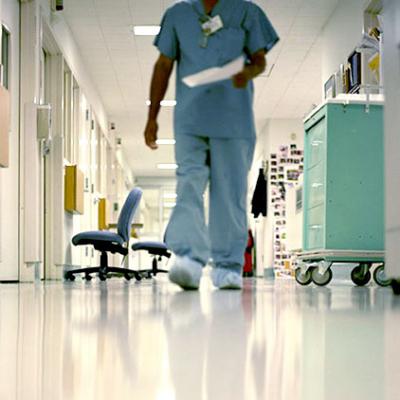
Find the location of `yellow wall box`. yellow wall box is located at coordinates (102, 209), (68, 186).